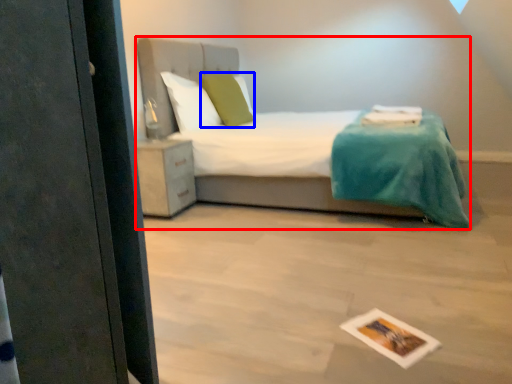
Question: Which of the following is the farthest to the observer, bed (highlighted by a red box) or pillow (highlighted by a blue box)?

Choices:
 (A) bed
 (B) pillow

Answer: (B)